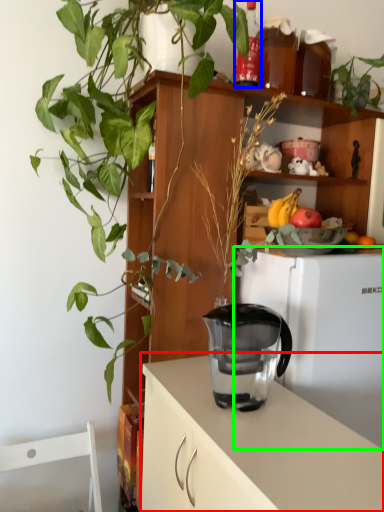
Question: Which object is positioned closest to cabinetry (highlighted by a red box)? Select from bottle (highlighted by a blue box) and refrigerator (highlighted by a green box).

Choices:
 (A) bottle
 (B) refrigerator

Answer: (B)